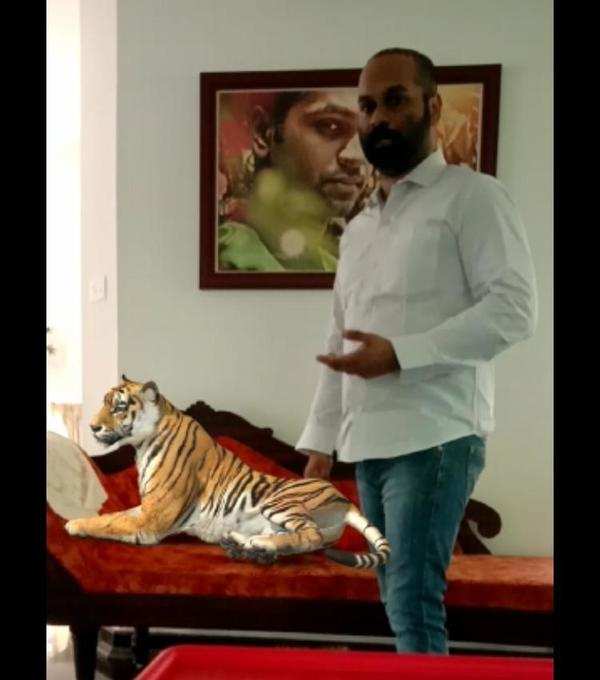
At what (x,y) coordinates should I click in order to perform the action: click on gray wall. Please return your answer as a coordinate pair (x, y). The image size is (600, 680). Looking at the image, I should click on (243, 339).